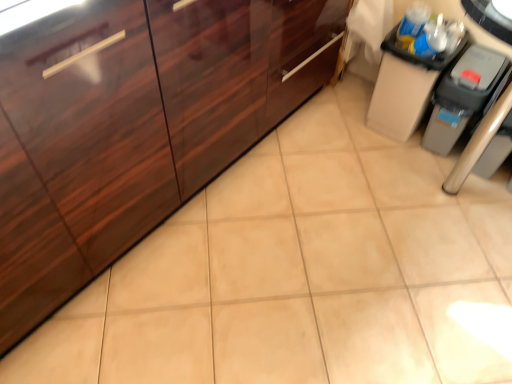
The image size is (512, 384). What do you see at coordinates (136, 126) in the screenshot? I see `glossy wood cabinetry at left, marked as the 1th cabinetry in a left-to-right arrangement` at bounding box center [136, 126].

Describe the element at coordinates (403, 88) in the screenshot. The width and height of the screenshot is (512, 384). I see `matte black trash can at upper right, positioned as the 1th cabinetry in right-to-left order` at that location.

Identify the location of gray plastic trash can at right. The height and width of the screenshot is (384, 512). (462, 96).

What are the coordinates of `glossy wood cabinetry at left, marked as the 1th cabinetry in a left-to-right arrangement` in the screenshot? It's located at pos(136,126).

Can you confirm if gray plastic trash can at right is smaller than matte black trash can at upper right, positioned as the 1th cabinetry in right-to-left order?

Correct, gray plastic trash can at right occupies less space than matte black trash can at upper right, positioned as the 1th cabinetry in right-to-left order.

Which point is more forward, (x=464, y=69) or (x=393, y=81)?

Point (x=464, y=69)

From their relative heights in the image, would you say gray plastic trash can at right is taller or shorter than matte black trash can at upper right, positioned as the 1th cabinetry in right-to-left order?

gray plastic trash can at right is shorter than matte black trash can at upper right, positioned as the 1th cabinetry in right-to-left order.

Is gray plastic trash can at right surrounding matte black trash can at upper right, positioned as the 1th cabinetry in right-to-left order?

Actually, matte black trash can at upper right, positioned as the 1th cabinetry in right-to-left order, is outside gray plastic trash can at right.

Who is shorter, matte black trash can at upper right, positioned as the 1th cabinetry in right-to-left order, or glossy wood cabinetry at left, marked as the 1th cabinetry in a left-to-right arrangement?

matte black trash can at upper right, positioned as the 1th cabinetry in right-to-left order, is shorter.

Looking at this image, is matte black trash can at upper right, positioned as the 1th cabinetry in right-to-left order, not close to glossy wood cabinetry at left, the second cabinetry in the right-to-left sequence?

matte black trash can at upper right, positioned as the 1th cabinetry in right-to-left order, is actually quite close to glossy wood cabinetry at left, the second cabinetry in the right-to-left sequence.

Considering the positions of objects matte black trash can at upper right, positioned as the 1th cabinetry in right-to-left order, and glossy wood cabinetry at left, marked as the 1th cabinetry in a left-to-right arrangement, in the image provided, who is more to the left, matte black trash can at upper right, positioned as the 1th cabinetry in right-to-left order, or glossy wood cabinetry at left, marked as the 1th cabinetry in a left-to-right arrangement,?

Positioned to the left is glossy wood cabinetry at left, marked as the 1th cabinetry in a left-to-right arrangement.

From a real-world perspective, is matte black trash can at upper right, positioned as the 1th cabinetry in right-to-left order, above or below glossy wood cabinetry at left, the second cabinetry in the right-to-left sequence?

In terms of real-world spatial position, matte black trash can at upper right, positioned as the 1th cabinetry in right-to-left order, is below glossy wood cabinetry at left, the second cabinetry in the right-to-left sequence.

From the image's perspective, which object appears higher, matte black trash can at upper right, positioned as the 1th cabinetry in right-to-left order, or gray plastic trash can at right?

matte black trash can at upper right, positioned as the 1th cabinetry in right-to-left order, from the image's perspective.

Could you tell me if matte black trash can at upper right, positioned as the 1th cabinetry in right-to-left order, is turned towards gray plastic trash can at right?

No.

Which of these two, matte black trash can at upper right, positioned as the 1th cabinetry in right-to-left order, or gray plastic trash can at right, stands shorter?

With less height is gray plastic trash can at right.

Could you measure the distance between gray plastic trash can at right and glossy wood cabinetry at left, the second cabinetry in the right-to-left sequence?

They are 34.03 inches apart.

Considering the points (485, 62) and (50, 143), which point is behind, point (485, 62) or point (50, 143)?

The point (485, 62) is farther.

This screenshot has height=384, width=512. There is a gray plastic trash can at right. What are the coordinates of `the 2nd cabinetry above it (from a real-world perspective)` in the screenshot? It's located at (136, 126).

Can you tell me how much gray plastic trash can at right and glossy wood cabinetry at left, the second cabinetry in the right-to-left sequence, differ in facing direction?

89.3 degrees separate the facing orientations of gray plastic trash can at right and glossy wood cabinetry at left, the second cabinetry in the right-to-left sequence.

There is a gray plastic trash can at right. Identify the location of the 1st cabinetry above it (from the image's perspective). (136, 126).

From the image's perspective, which one is positioned lower, glossy wood cabinetry at left, marked as the 1th cabinetry in a left-to-right arrangement, or gray plastic trash can at right?

gray plastic trash can at right is shown below in the image.

Considering the positions of points (73, 169) and (460, 73), is point (73, 169) closer to camera compared to point (460, 73)?

Yes, point (73, 169) is in front of point (460, 73).

Who is shorter, glossy wood cabinetry at left, marked as the 1th cabinetry in a left-to-right arrangement, or matte black trash can at upper right, acting as the 2th cabinetry starting from the left?

Standing shorter between the two is matte black trash can at upper right, acting as the 2th cabinetry starting from the left.

From a real-world perspective, is glossy wood cabinetry at left, the second cabinetry in the right-to-left sequence, above or below matte black trash can at upper right, acting as the 2th cabinetry starting from the left?

From a real-world perspective, glossy wood cabinetry at left, the second cabinetry in the right-to-left sequence, is physically above matte black trash can at upper right, acting as the 2th cabinetry starting from the left.

Based on the photo, is glossy wood cabinetry at left, marked as the 1th cabinetry in a left-to-right arrangement, with matte black trash can at upper right, acting as the 2th cabinetry starting from the left?

No, glossy wood cabinetry at left, marked as the 1th cabinetry in a left-to-right arrangement, is not beside matte black trash can at upper right, acting as the 2th cabinetry starting from the left.

Is glossy wood cabinetry at left, the second cabinetry in the right-to-left sequence, bigger or smaller than matte black trash can at upper right, acting as the 2th cabinetry starting from the left?

Considering their sizes, glossy wood cabinetry at left, the second cabinetry in the right-to-left sequence, takes up more space than matte black trash can at upper right, acting as the 2th cabinetry starting from the left.

Where is `appliance on the right of matte black trash can at upper right, acting as the 2th cabinetry starting from the left`? appliance on the right of matte black trash can at upper right, acting as the 2th cabinetry starting from the left is located at coordinates (462, 96).

At what (x,y) coordinates should I click in order to perform the action: click on cabinetry located above the matte black trash can at upper right, acting as the 2th cabinetry starting from the left (from a real-world perspective). Please return your answer as a coordinate pair (x, y). Looking at the image, I should click on (136, 126).

Based on the photo, based on their spatial positions, is matte black trash can at upper right, positioned as the 1th cabinetry in right-to-left order, or glossy wood cabinetry at left, the second cabinetry in the right-to-left sequence, further from gray plastic trash can at right?

glossy wood cabinetry at left, the second cabinetry in the right-to-left sequence, is further to gray plastic trash can at right.

From the image, which object appears to be nearer to gray plastic trash can at right, glossy wood cabinetry at left, the second cabinetry in the right-to-left sequence, or matte black trash can at upper right, positioned as the 1th cabinetry in right-to-left order?

The object closer to gray plastic trash can at right is matte black trash can at upper right, positioned as the 1th cabinetry in right-to-left order.

Which object lies nearer to the anchor point glossy wood cabinetry at left, the second cabinetry in the right-to-left sequence, matte black trash can at upper right, acting as the 2th cabinetry starting from the left, or gray plastic trash can at right?

matte black trash can at upper right, acting as the 2th cabinetry starting from the left, lies closer to glossy wood cabinetry at left, the second cabinetry in the right-to-left sequence, than the other object.

When comparing their distances from glossy wood cabinetry at left, the second cabinetry in the right-to-left sequence, does gray plastic trash can at right or matte black trash can at upper right, positioned as the 1th cabinetry in right-to-left order, seem closer?

matte black trash can at upper right, positioned as the 1th cabinetry in right-to-left order, is closer to glossy wood cabinetry at left, the second cabinetry in the right-to-left sequence.

Looking at the image, which one is located closer to matte black trash can at upper right, positioned as the 1th cabinetry in right-to-left order, gray plastic trash can at right or glossy wood cabinetry at left, marked as the 1th cabinetry in a left-to-right arrangement?

Among the two, gray plastic trash can at right is located nearer to matte black trash can at upper right, positioned as the 1th cabinetry in right-to-left order.

When comparing their distances from matte black trash can at upper right, positioned as the 1th cabinetry in right-to-left order, does glossy wood cabinetry at left, the second cabinetry in the right-to-left sequence, or gray plastic trash can at right seem closer?

The object closer to matte black trash can at upper right, positioned as the 1th cabinetry in right-to-left order, is gray plastic trash can at right.

Locate an element on the screen. The width and height of the screenshot is (512, 384). cabinetry located between glossy wood cabinetry at left, the second cabinetry in the right-to-left sequence, and gray plastic trash can at right in the left-right direction is located at coordinates (403, 88).